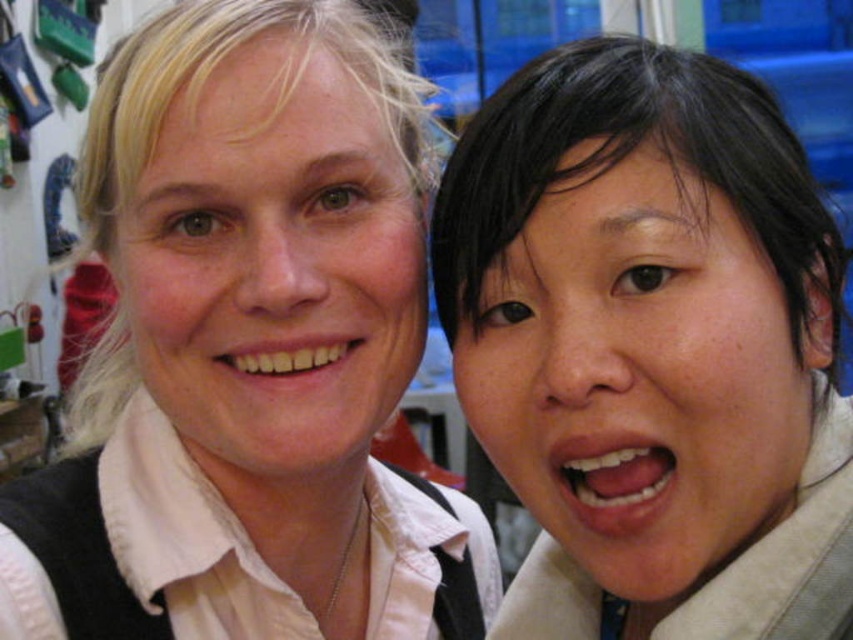
You are taking a photo of two people standing close together. You notice the matte white shirt at center and the matte white face at upper left. Since both are white, will the camera have difficulty distinguishing them due to their similar colors?

The matte white shirt at center is 1.66 inches from matte white face at upper left, so the camera can distinguish them based on their proximity and slight color variations.

You are a photographer trying to adjust the lighting for a portrait. You notice two reflective surfaces in the image. Which object, the matte white face at upper left or the white glossy teeth at lower right, is positioned to the left of the other?

The matte white face at upper left is positioned to the left of the white glossy teeth at lower right.

In the scene shown: You are a photographer adjusting the camera settings to ensure both the matte white face at upper left and the white glossy teeth at lower right are clearly visible in the photo. Based on their positions, which object should you focus on first to ensure depth of field captures both?

You should focus on the matte white face at upper left first because the white glossy teeth at lower right is behind it, ensuring the depth of field will include both when focusing on the closer object.